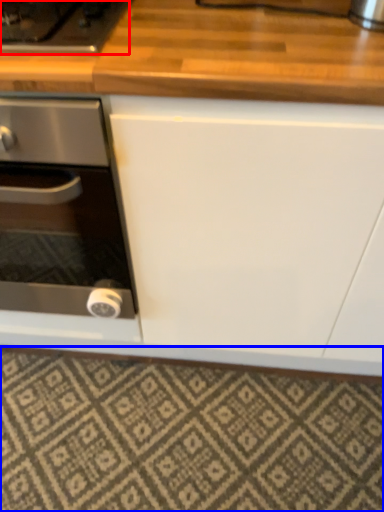
Question: Which point is further to the camera, gas stove (highlighted by a red box) or tile (highlighted by a blue box)?

Choices:
 (A) gas stove
 (B) tile

Answer: (B)